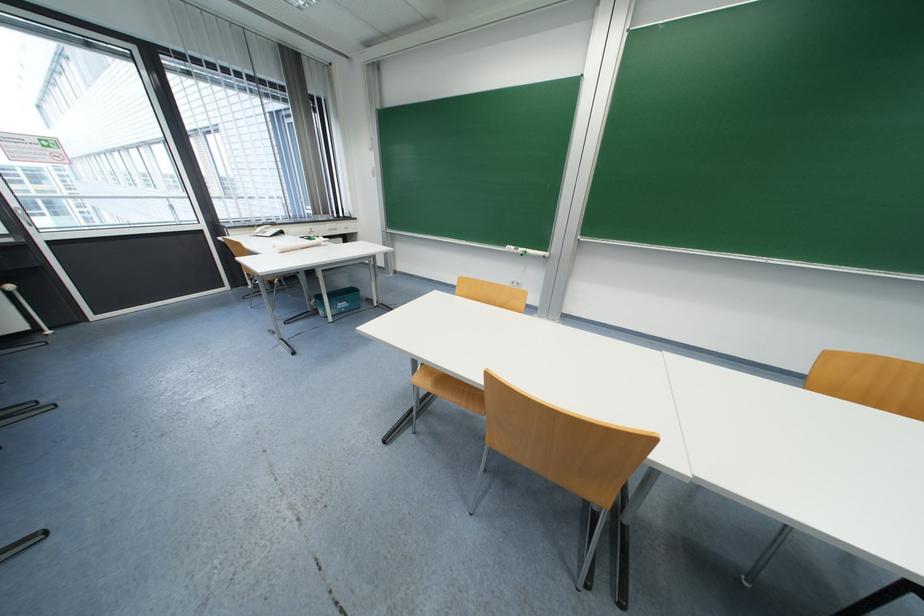
Identify the location of chair sitting surface. The image size is (924, 616). (448, 389).